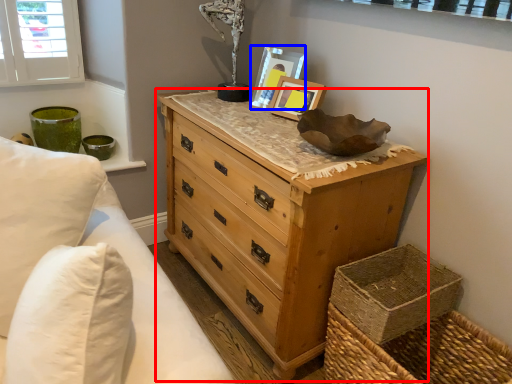
Question: Which of the following is the farthest to the observer, chest of drawers (highlighted by a red box) or picture frame (highlighted by a blue box)?

Choices:
 (A) chest of drawers
 (B) picture frame

Answer: (B)